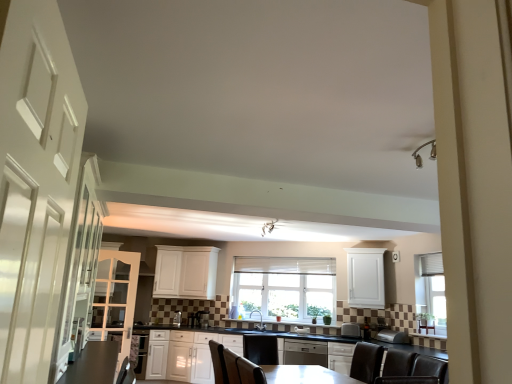
Where is `satin silver toaster at lower center, which ranks as the 2th appliance in back-to-front order`? The height and width of the screenshot is (384, 512). satin silver toaster at lower center, which ranks as the 2th appliance in back-to-front order is located at coordinates (177, 318).

In the scene shown: What is the approximate height of satin black dishwasher at center?

satin black dishwasher at center is 20.00 inches tall.

Identify the location of satin black dishwasher at center. (305, 353).

At what (x,y) coordinates should I click in order to perform the action: click on metallic silver swivel chair at lower center. Please return your answer as a coordinate pair (x, y). The height and width of the screenshot is (384, 512). Looking at the image, I should click on (351, 330).

Is satin silver toaster at lower center, positioned as the third appliance in front-to-back order, inside or outside of metallic silver light fixture at upper center?

satin silver toaster at lower center, positioned as the third appliance in front-to-back order, exists outside the volume of metallic silver light fixture at upper center.

Between satin silver toaster at lower center, positioned as the third appliance in front-to-back order, and metallic silver light fixture at upper center, which one appears on the right side from the viewer's perspective?

Positioned to the right is metallic silver light fixture at upper center.

Considering the sizes of satin silver toaster at lower center, positioned as the third appliance in front-to-back order, and metallic silver light fixture at upper center in the image, is satin silver toaster at lower center, positioned as the third appliance in front-to-back order, wider or thinner than metallic silver light fixture at upper center?

In the image, satin silver toaster at lower center, positioned as the third appliance in front-to-back order, appears to be more narrow than metallic silver light fixture at upper center.

Is satin silver toaster at lower center, the first appliance when ordered from front to back, located outside metallic silver swivel chair at lower center?

satin silver toaster at lower center, the first appliance when ordered from front to back, lies outside metallic silver swivel chair at lower center's area.

You are a GUI agent. You are given a task and a screenshot of the screen. Output one action in this format:
    pyautogui.click(x=<x>, y=<y>)
    Task: Click on the swivel chair located behind the satin silver toaster at lower center, the first appliance when ordered from front to back
    
    Given the screenshot: What is the action you would take?
    pyautogui.click(x=351, y=330)

Does satin silver toaster at lower center, the 1th appliance positioned from the right, have a smaller size compared to metallic silver swivel chair at lower center?

Incorrect, satin silver toaster at lower center, the 1th appliance positioned from the right, is not smaller in size than metallic silver swivel chair at lower center.

From the image's perspective, would you say metallic silver light fixture at upper center is shown under satin black dishwasher at center?

Actually, metallic silver light fixture at upper center appears above satin black dishwasher at center in the image.

The image size is (512, 384). Identify the location of dish washer lying on the right of metallic silver light fixture at upper center. (305, 353).

Between metallic silver light fixture at upper center and satin black dishwasher at center, which one has more height?

Standing taller between the two is satin black dishwasher at center.

Is metallic silver light fixture at upper center bigger or smaller than satin black dishwasher at center?

Clearly, metallic silver light fixture at upper center is smaller in size than satin black dishwasher at center.

In the scene shown: Is white glossy cabinet at left, the 1th cabinetry when ordered from left to right, far from satin silver toaster at lower center, acting as the third appliance starting from the back?

Yes, white glossy cabinet at left, the 1th cabinetry when ordered from left to right, and satin silver toaster at lower center, acting as the third appliance starting from the back, are located far from each other.

Is white glossy cabinet at left, the 5th cabinetry from the right, oriented towards satin silver toaster at lower center, the 3th appliance positioned from the left?

No, white glossy cabinet at left, the 5th cabinetry from the right, is not oriented towards satin silver toaster at lower center, the 3th appliance positioned from the left.

Does white glossy cabinet at left, the 1th cabinetry when ordered from left to right, have a greater width compared to satin silver toaster at lower center, the first appliance when ordered from front to back?

No, white glossy cabinet at left, the 1th cabinetry when ordered from left to right, is not wider than satin silver toaster at lower center, the first appliance when ordered from front to back.

Considering the relative sizes of white textured window at center and satin nickel faucet at center in the image provided, is white textured window at center bigger than satin nickel faucet at center?

Yes.

Looking at this image, in terms of height, does white textured window at center look taller or shorter compared to satin nickel faucet at center?

Clearly, white textured window at center is taller compared to satin nickel faucet at center.

Which of these two, white textured window at center or satin nickel faucet at center, is wider?

satin nickel faucet at center.

What's the angular difference between white textured window at center and satin nickel faucet at center's facing directions?

The angular difference between white textured window at center and satin nickel faucet at center is 28.8 degrees.

Can you tell me how much metallic silver swivel chair at lower center and satin silver toaster at lower center, positioned as the 3th appliance in right-to-left order, differ in facing direction?

12.9 degrees.

Can you confirm if metallic silver swivel chair at lower center is smaller than satin silver toaster at lower center, the 2th appliance viewed from the front?

Incorrect, metallic silver swivel chair at lower center is not smaller in size than satin silver toaster at lower center, the 2th appliance viewed from the front.

Is metallic silver swivel chair at lower center taller than satin silver toaster at lower center, the first appliance positioned from the left?

No.

Can you confirm if satin silver toaster at lower center, the 2th appliance viewed from the front, is shorter than white textured window at center?

Indeed, satin silver toaster at lower center, the 2th appliance viewed from the front, has a lesser height compared to white textured window at center.

Is satin silver toaster at lower center, positioned as the 3th appliance in right-to-left order, far from white textured window at center?

Absolutely, satin silver toaster at lower center, positioned as the 3th appliance in right-to-left order, is distant from white textured window at center.

Identify the location of the 1st appliance behind the white textured window at center, starting your count from the anchor. (177, 318).

The image size is (512, 384). In order to click on light fixture on the right side of satin silver toaster at lower center, which is counted as the second appliance, starting from the left in this screenshot , I will do `click(268, 227)`.

At what (x,y) coordinates should I click in order to perform the action: click on swivel chair above the satin silver toaster at lower center, the 1th appliance positioned from the right (from a real-world perspective). Please return your answer as a coordinate pair (x, y). Image resolution: width=512 pixels, height=384 pixels. Looking at the image, I should click on (351, 330).

Based on their spatial positions, is white glossy cabinets at center, the third cabinetry from the right, or white textured window at center further from white glossy cabinet at left, the 5th cabinetry from the right?

The object further to white glossy cabinet at left, the 5th cabinetry from the right, is white textured window at center.

Estimate the real-world distances between objects in this image. Which object is closer to white matte cabinet at upper right, the fifth cabinetry viewed from the left, white glossy cabinet at left, the 1th cabinetry when ordered from left to right, or white textured window at center?

white textured window at center.

Estimate the real-world distances between objects in this image. Which object is further from satin silver toaster at lower center, acting as the third appliance starting from the back, satin silver toaster at lower center, which is the first appliance in back-to-front order, or satin silver toaster at lower center, the first appliance positioned from the left?

satin silver toaster at lower center, the first appliance positioned from the left, is further to satin silver toaster at lower center, acting as the third appliance starting from the back.

Based on their spatial positions, is white matte cabinet at center, the fourth cabinetry when ordered from right to left, or satin silver toaster at lower center, the first appliance when ordered from front to back, further from white glossy cabinet at left, the 1th cabinetry when ordered from left to right?

satin silver toaster at lower center, the first appliance when ordered from front to back, is further to white glossy cabinet at left, the 1th cabinetry when ordered from left to right.

Considering their positions, is satin silver toaster at lower center, which is the first appliance in back-to-front order, positioned further to white glossy cabinets at center, the third cabinetry from the right, than white textured window at center?

The object further to white glossy cabinets at center, the third cabinetry from the right, is white textured window at center.

Estimate the real-world distances between objects in this image. Which object is closer to satin silver toaster at lower center, the first appliance positioned from the left, satin silver toaster at lower center, the 1th appliance positioned from the right, or metallic silver light fixture at upper center?

The object closer to satin silver toaster at lower center, the first appliance positioned from the left, is metallic silver light fixture at upper center.

Estimate the real-world distances between objects in this image. Which object is closer to satin black dishwasher at center, white matte cabinet at upper right, acting as the first cabinetry starting from the right, or white textured window at center?

Based on the image, white textured window at center appears to be nearer to satin black dishwasher at center.

Estimate the real-world distances between objects in this image. Which object is further from white glossy cabinet at center, marked as the 4th cabinetry in a left-to-right arrangement, white glossy door at left or satin silver toaster at lower center, the first appliance when ordered from front to back?

white glossy door at left is positioned further to the anchor white glossy cabinet at center, marked as the 4th cabinetry in a left-to-right arrangement.

Locate an element on the screen. This screenshot has width=512, height=384. window between satin black dishwasher at center and satin nickel faucet at center along the z-axis is located at coordinates (284, 287).

Find the location of a particular element. The width and height of the screenshot is (512, 384). swivel chair between satin black dishwasher at center and satin silver toaster at lower center, the 3th appliance positioned from the left is located at coordinates (351, 330).

The width and height of the screenshot is (512, 384). I want to click on sink situated between white matte cabinet at center, acting as the second cabinetry starting from the left, and satin silver toaster at lower center, the 1th appliance positioned from the right, from left to right, so click(x=260, y=321).

This screenshot has height=384, width=512. Identify the location of sink between white glossy cabinets at center, which appears as the 3th cabinetry when viewed from the left, and white glossy cabinet at center, marked as the 4th cabinetry in a left-to-right arrangement, from left to right. (260, 321).